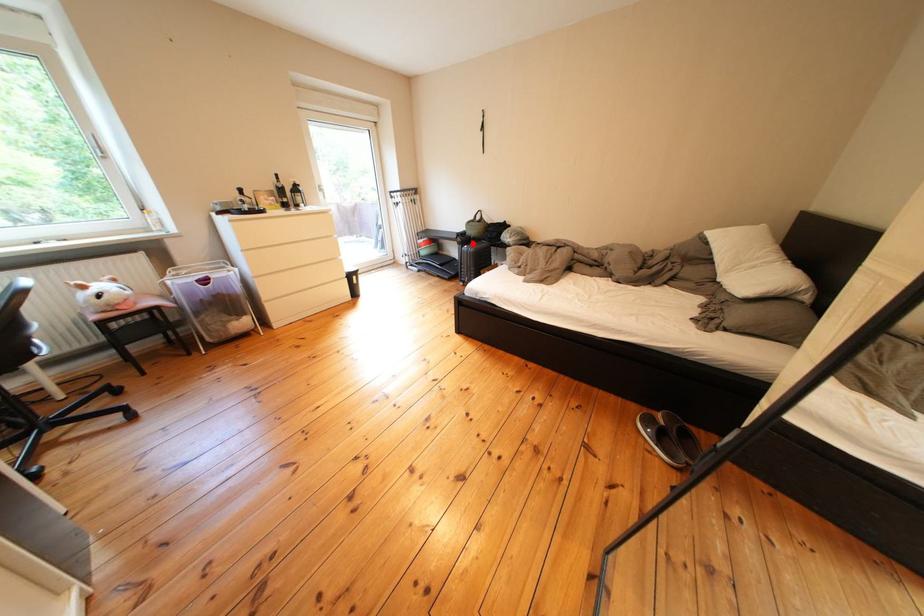
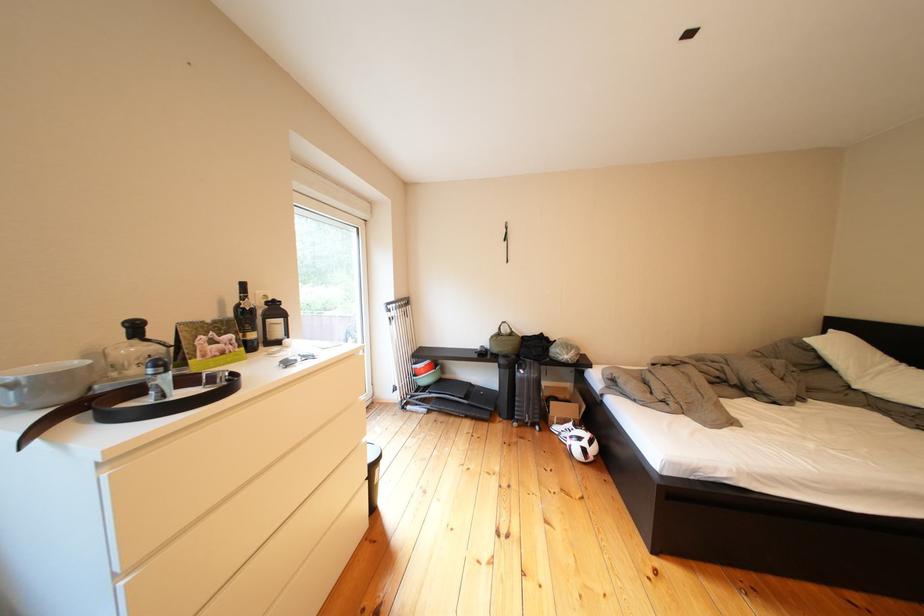
Question: A red point is marked in image1. In image2, is the corresponding 3D point closer to the camera or farther? Reply with the corresponding letter.

Choices:
 (A) The corresponding 3D point is closer.
 (B) The corresponding 3D point is farther.

Answer: (B)